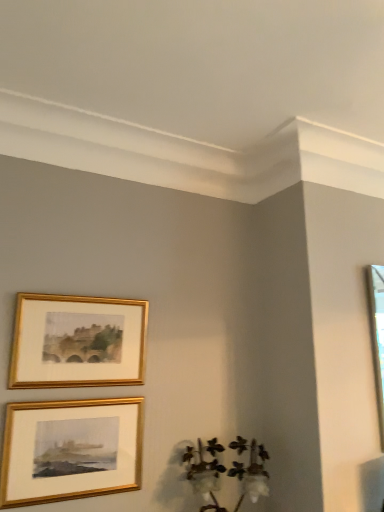
Question: Does white cotton at lower right have a lesser width compared to gold/gilded picture frame at upper left, placed as the 1th picture frame when sorted from top to bottom?

Choices:
 (A) no
 (B) yes

Answer: (A)

Question: Considering the relative sizes of white cotton at lower right and gold/gilded picture frame at upper left, placed as the 1th picture frame when sorted from top to bottom, in the image provided, is white cotton at lower right bigger than gold/gilded picture frame at upper left, placed as the 1th picture frame when sorted from top to bottom,?

Choices:
 (A) no
 (B) yes

Answer: (B)

Question: Is white cotton at lower right positioned before gold/gilded picture frame at upper left, which is counted as the second picture frame, starting from the bottom?

Choices:
 (A) no
 (B) yes

Answer: (B)

Question: Is gold/gilded picture frame at upper left, placed as the 1th picture frame when sorted from top to bottom, surrounded by white cotton at lower right?

Choices:
 (A) no
 (B) yes

Answer: (A)

Question: Is the depth of white cotton at lower right greater than that of gold/gilded picture frame at upper left, placed as the 1th picture frame when sorted from top to bottom?

Choices:
 (A) yes
 (B) no

Answer: (B)

Question: From the image's perspective, does white cotton at lower right appear higher than gold/gilded picture frame at upper left, placed as the 1th picture frame when sorted from top to bottom?

Choices:
 (A) no
 (B) yes

Answer: (A)

Question: From the image's perspective, does gold/glossy picture frame at lower left, positioned as the 1th picture frame in bottom-to-top order, appear higher than white cotton at lower right?

Choices:
 (A) yes
 (B) no

Answer: (A)

Question: Is gold/glossy picture frame at lower left, which appears as the second picture frame when viewed from the top, positioned with its back to white cotton at lower right?

Choices:
 (A) yes
 (B) no

Answer: (B)

Question: From the image's perspective, is gold/glossy picture frame at lower left, positioned as the 1th picture frame in bottom-to-top order, beneath white cotton at lower right?

Choices:
 (A) no
 (B) yes

Answer: (A)

Question: Does gold/glossy picture frame at lower left, positioned as the 1th picture frame in bottom-to-top order, appear on the left side of white cotton at lower right?

Choices:
 (A) no
 (B) yes

Answer: (B)

Question: Can you confirm if gold/glossy picture frame at lower left, positioned as the 1th picture frame in bottom-to-top order, is bigger than white cotton at lower right?

Choices:
 (A) no
 (B) yes

Answer: (A)

Question: Is the position of gold/glossy picture frame at lower left, which appears as the second picture frame when viewed from the top, more distant than that of white cotton at lower right?

Choices:
 (A) yes
 (B) no

Answer: (B)

Question: Could you tell me if gold/gilded picture frame at upper left, which is counted as the second picture frame, starting from the bottom, is facing gold/glossy picture frame at lower left, which appears as the second picture frame when viewed from the top?

Choices:
 (A) yes
 (B) no

Answer: (B)